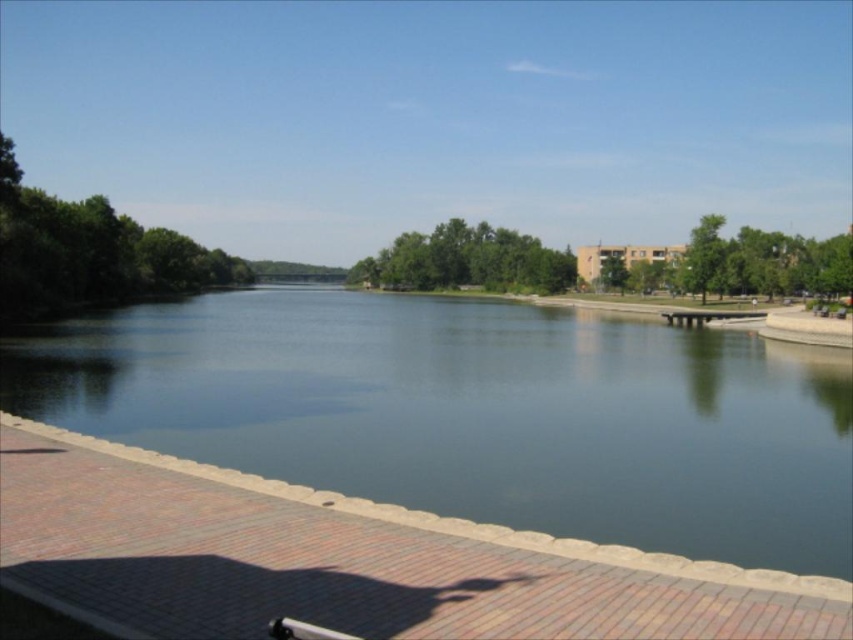
Does green smooth water at center have a lesser height compared to wooden park bench at center?

No.

Does green smooth water at center lie behind wooden park bench at center?

No.

Does point (618, 502) lie behind point (669, 323)?

No, (618, 502) is closer to viewer.

The height and width of the screenshot is (640, 853). Find the location of `green smooth water at center`. green smooth water at center is located at coordinates (474, 413).